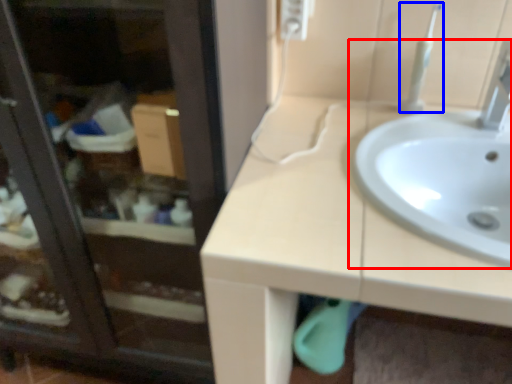
Question: Among these objects, which one is farthest to the camera, sink (highlighted by a red box) or toothbrush (highlighted by a blue box)?

Choices:
 (A) sink
 (B) toothbrush

Answer: (B)